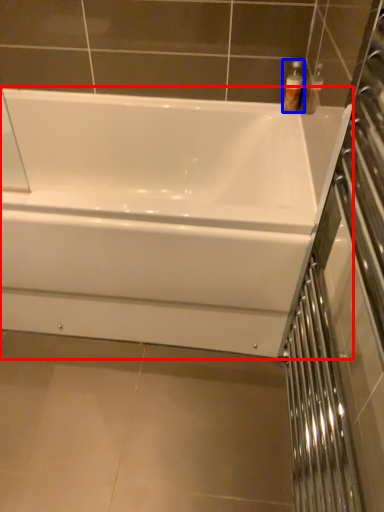
Question: Which object appears closest to the camera in this image, bathtub (highlighted by a red box) or toiletry (highlighted by a blue box)?

Choices:
 (A) bathtub
 (B) toiletry

Answer: (A)